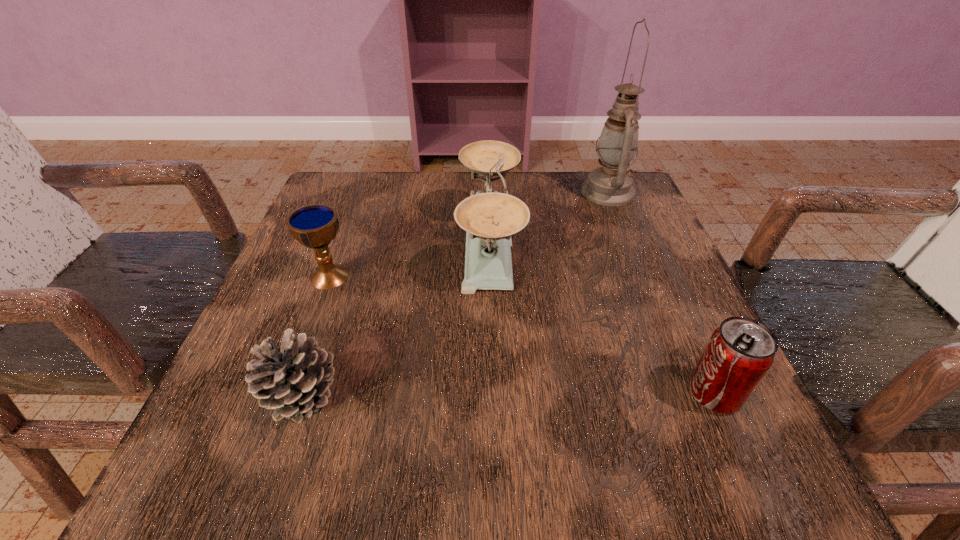
Find the location of a particular element. the tallest object is located at coordinates (611, 184).

Where is `scale`? This screenshot has width=960, height=540. scale is located at coordinates (489, 218).

At what (x,y) coordinates should I click in order to perform the action: click on the third object from right to left. Please return your answer as a coordinate pair (x, y). This screenshot has height=540, width=960. Looking at the image, I should click on (489, 218).

Locate an element on the screen. Image resolution: width=960 pixels, height=540 pixels. chalice is located at coordinates (314, 226).

Where is `pop soda`? This screenshot has height=540, width=960. pop soda is located at coordinates (739, 353).

Where is `pinecone`? The height and width of the screenshot is (540, 960). pinecone is located at coordinates (294, 380).

Identify the location of vacant region located on the front of the oil lamp. This screenshot has width=960, height=540. (632, 252).

The width and height of the screenshot is (960, 540). Identify the location of vacant space located on the front-facing side of the third object from left to right. (423, 246).

Find the location of a particular element. This screenshot has height=540, width=960. vacant area located 0.330m on the front-facing side of the third object from left to right is located at coordinates (296, 246).

This screenshot has height=540, width=960. I want to click on vacant space located on the front-facing side of the third object from left to right, so click(335, 246).